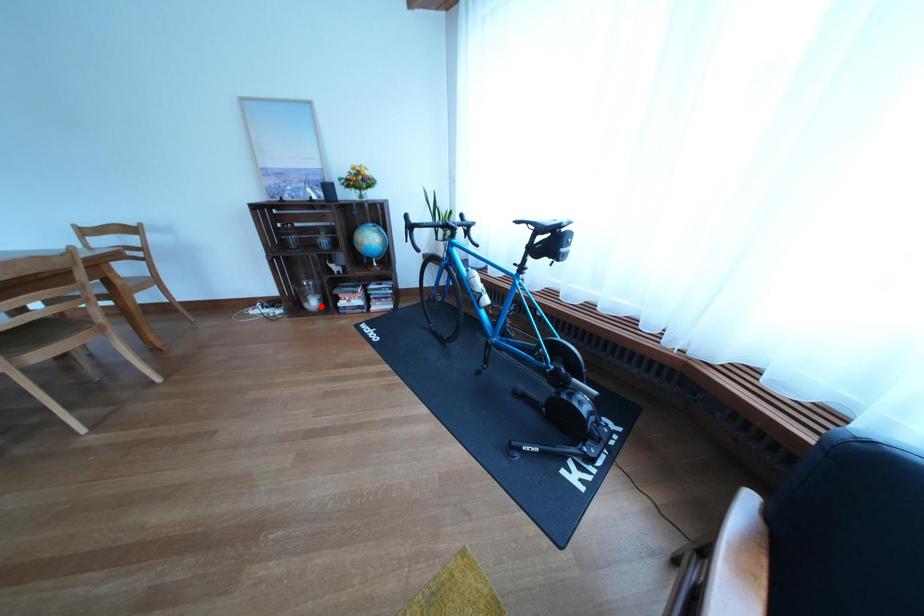
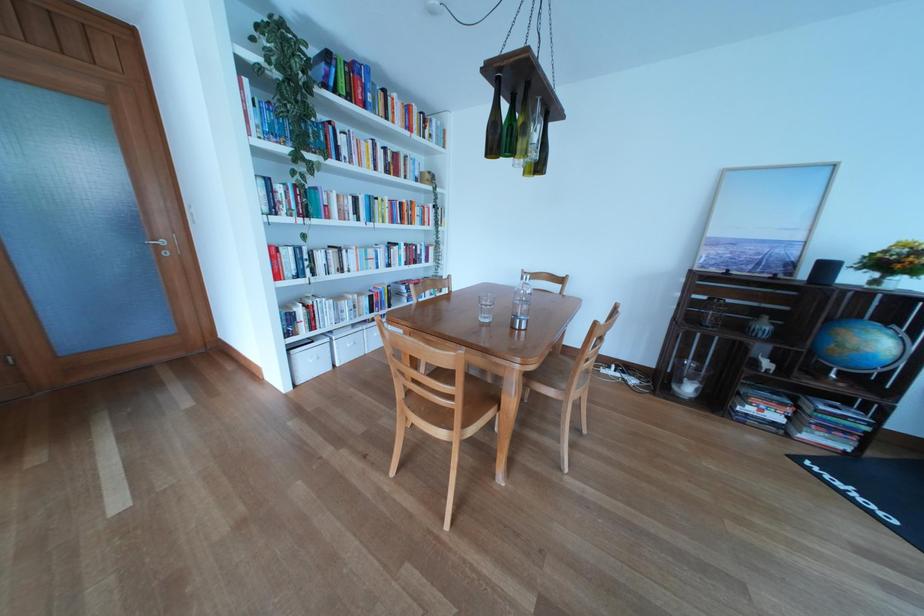
Locate, in the second image, the point that corresponds to the highlighted location in the first image.

(694, 389)